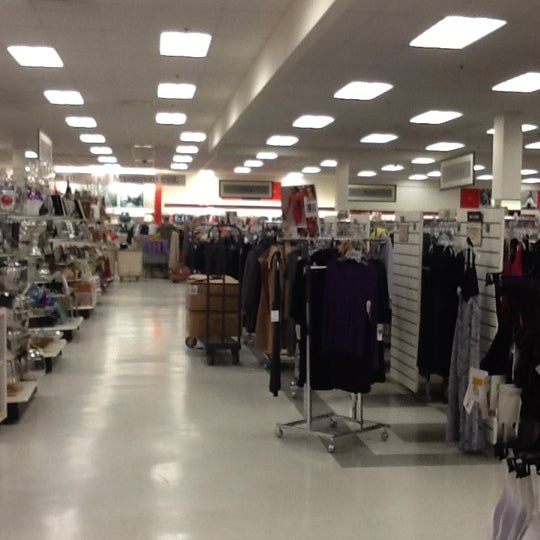
Find the location of a particular element. Image resolution: width=540 pixels, height=540 pixels. wall is located at coordinates (200, 195), (422, 195).